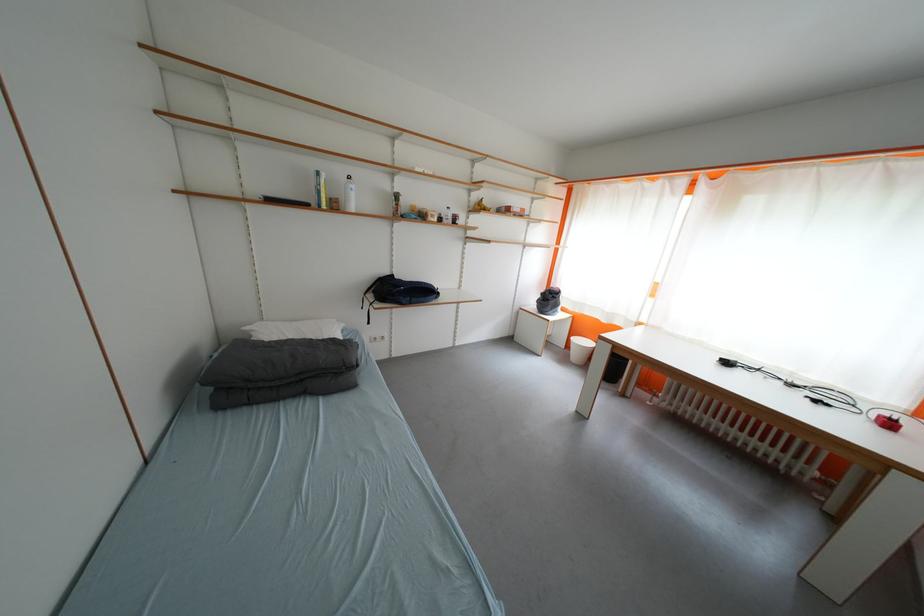
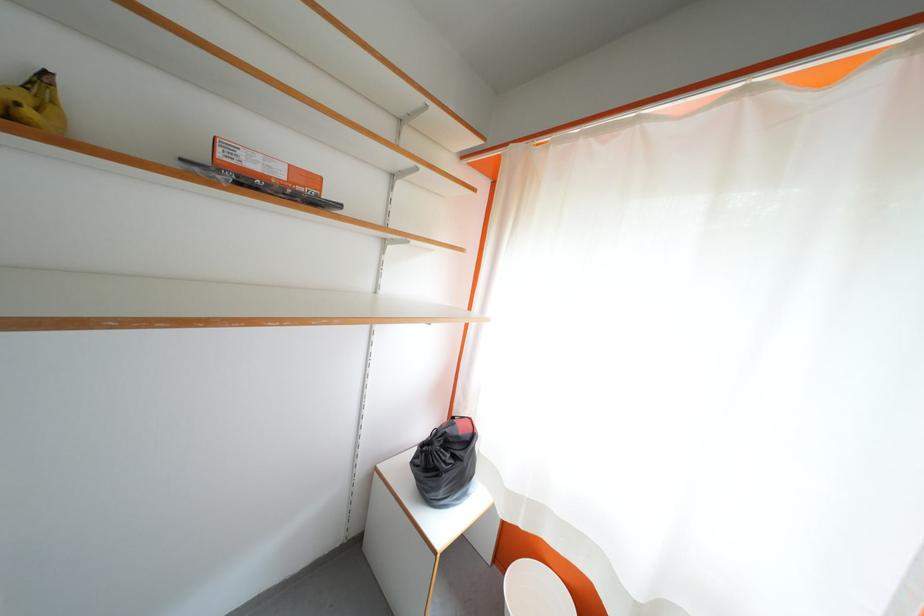
Where in the second image is the point corresponding to (x=558, y=302) from the first image?

(455, 460)